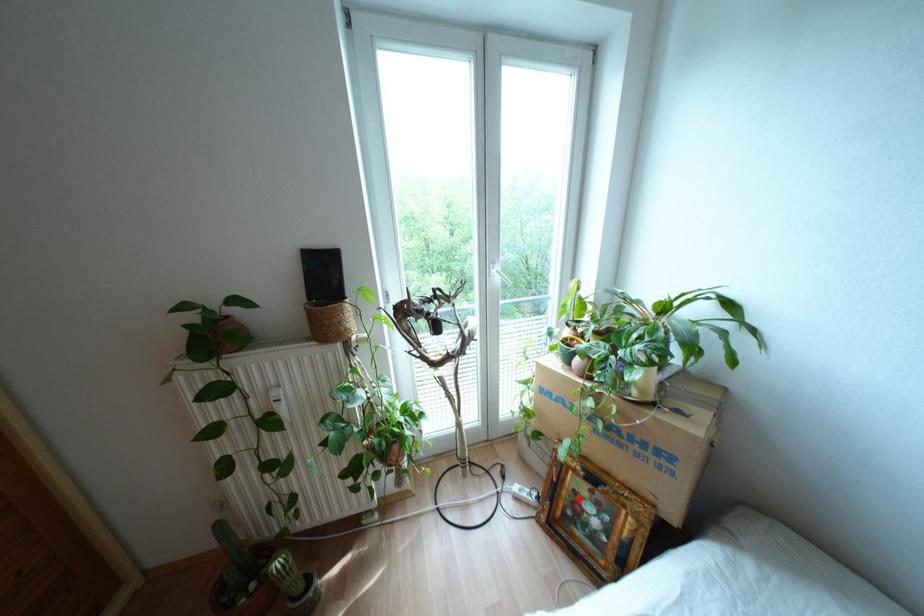
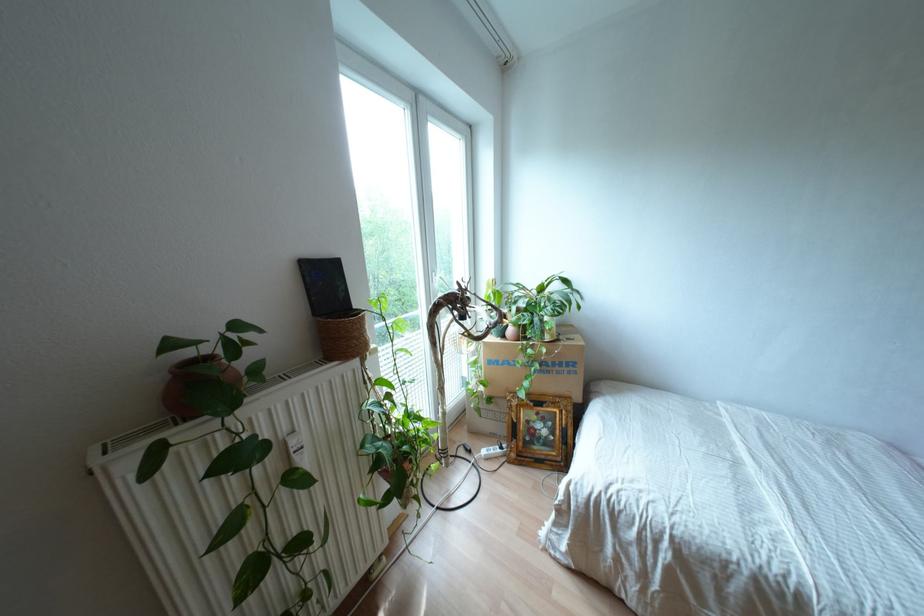
In the second image, find the point that corresponds to the highlighted location in the first image.

(530, 424)